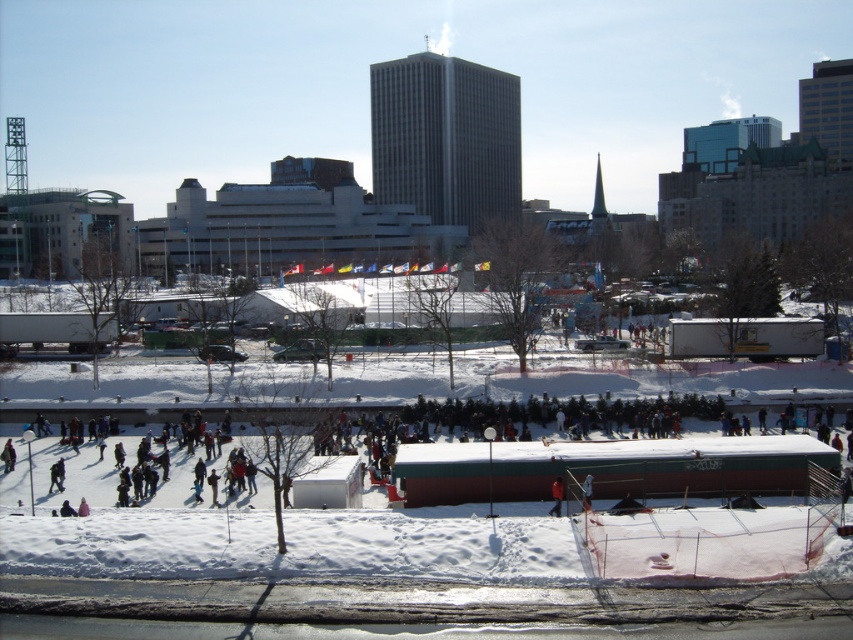
Which is below, dark gray snowboarder at center or orange fabric at center?

orange fabric at center is lower down.

Does point (527, 435) come in front of point (561, 484)?

That is False.

Identify the location of dark gray snowboarder at center. Image resolution: width=853 pixels, height=640 pixels. (654, 460).